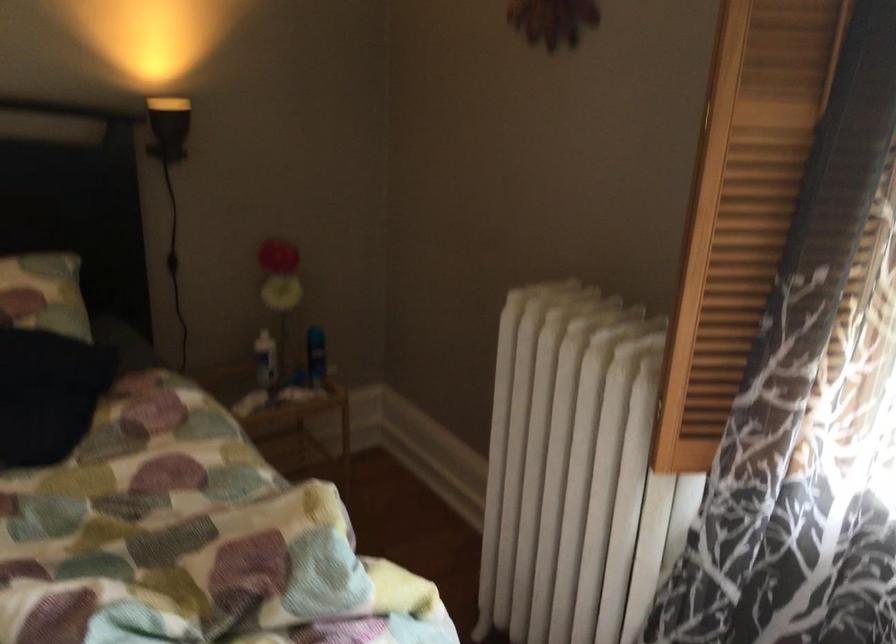
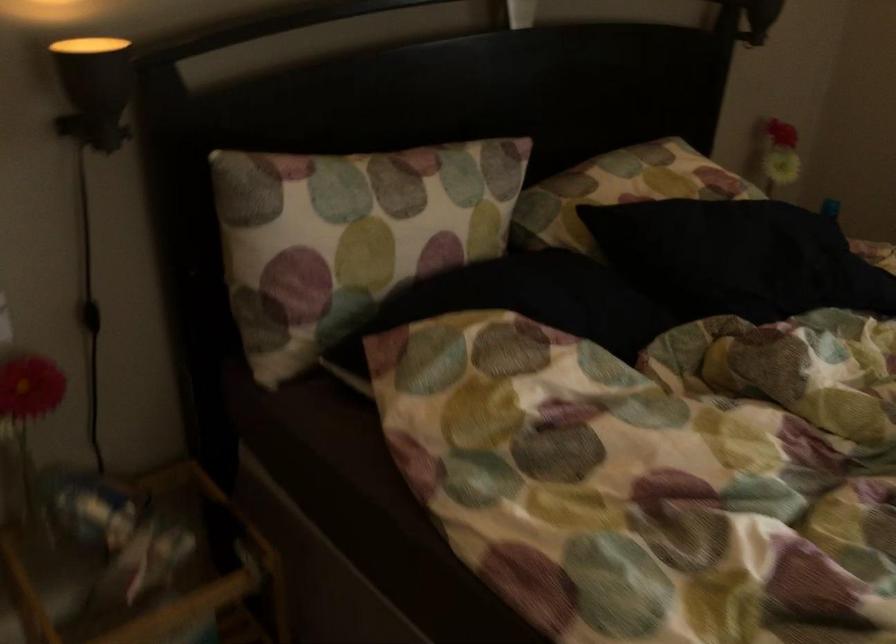
Question: The images are taken continuously from a first-person perspective. In which direction are you moving?

Choices:
 (A) Left
 (B) Right
 (C) Forward
 (D) Backward

Answer: (A)